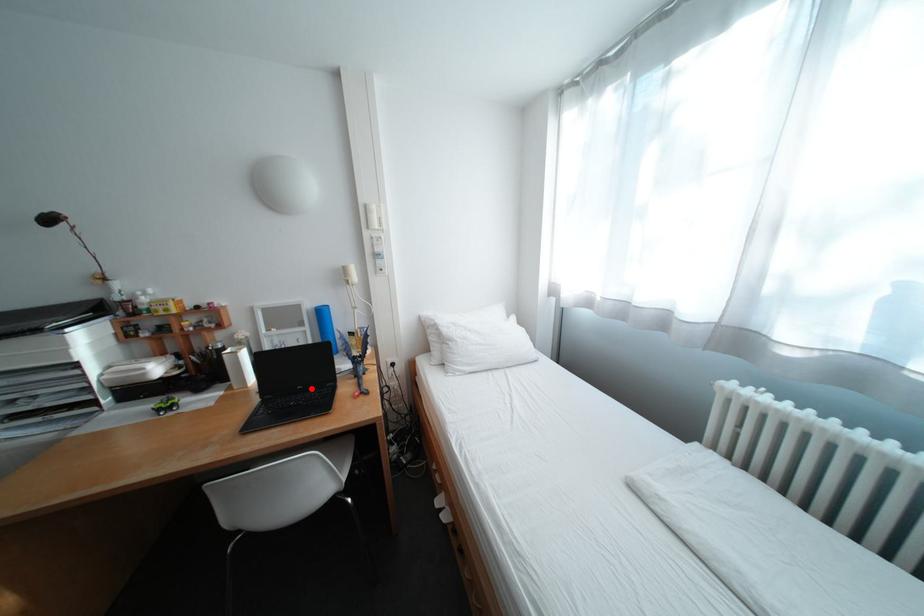
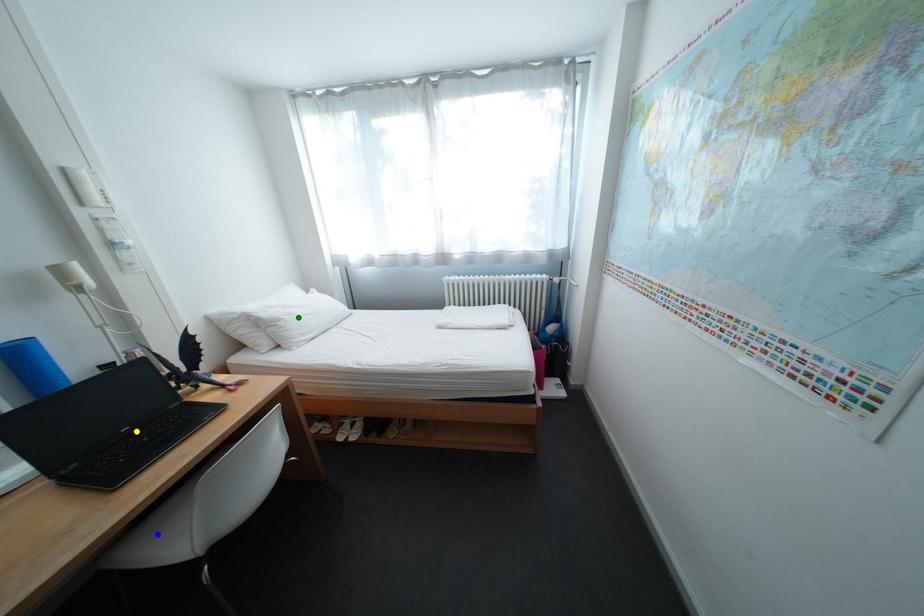
Question: I am providing you with two images of the same scene from different viewpoints. A red point is marked on the first image. You are given multiple points on the second image. In image 2, which mark is for the same physical point as the one in image 1?

Choices:
 (A) green point
 (B) blue point
 (C) yellow point

Answer: (C)